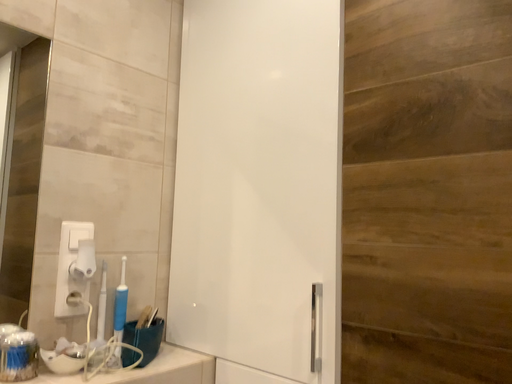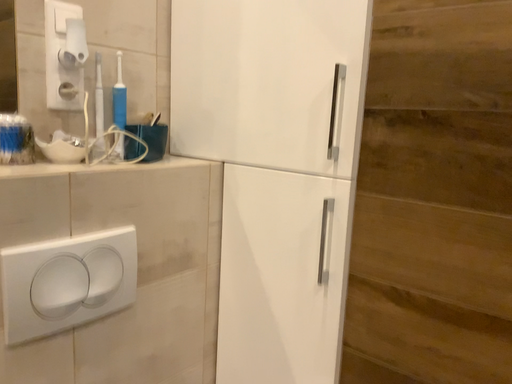
Question: How did the camera likely rotate when shooting the video?

Choices:
 (A) rotated downward
 (B) rotated upward

Answer: (A)